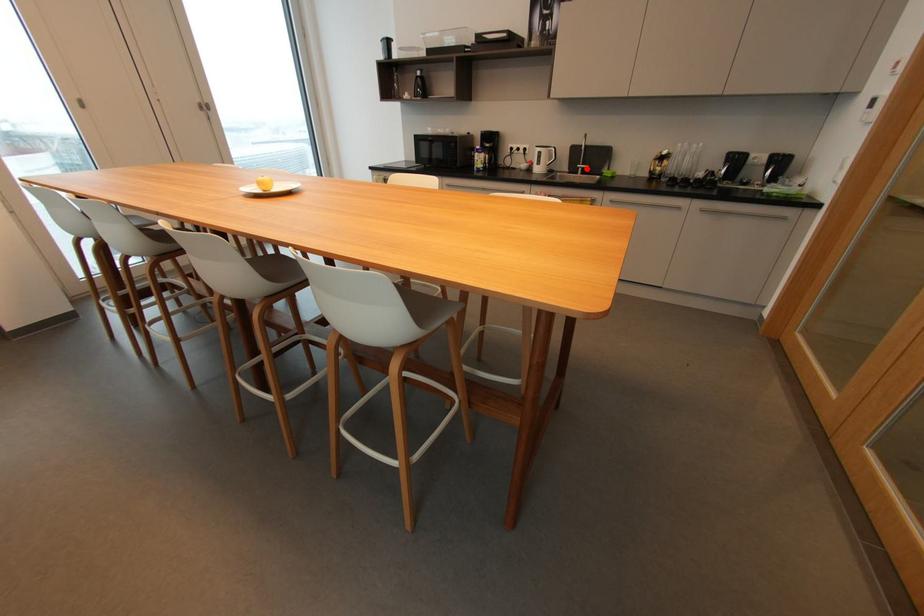
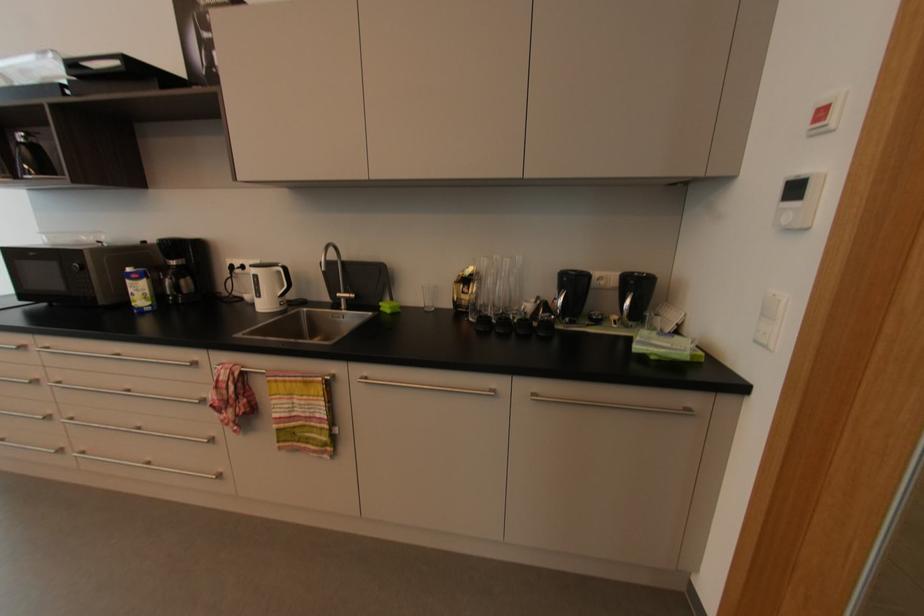
Question: A red point is marked in image1. In image2, is the corresponding 3D point closer to the camera or farther? Reply with the corresponding letter.

Choices:
 (A) The corresponding 3D point is closer.
 (B) The corresponding 3D point is farther.

Answer: (B)